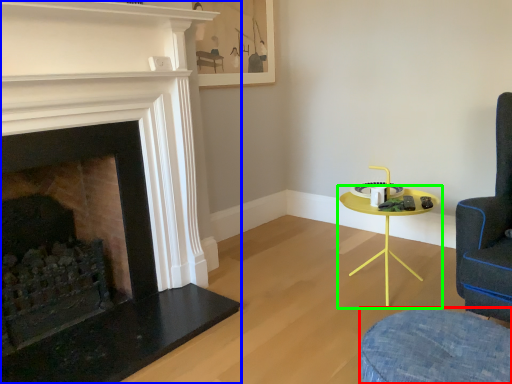
Question: Which object is positioned farthest from swivel chair (highlighted by a red box)? Select from fireplace (highlighted by a blue box) and table (highlighted by a green box).

Choices:
 (A) fireplace
 (B) table

Answer: (A)